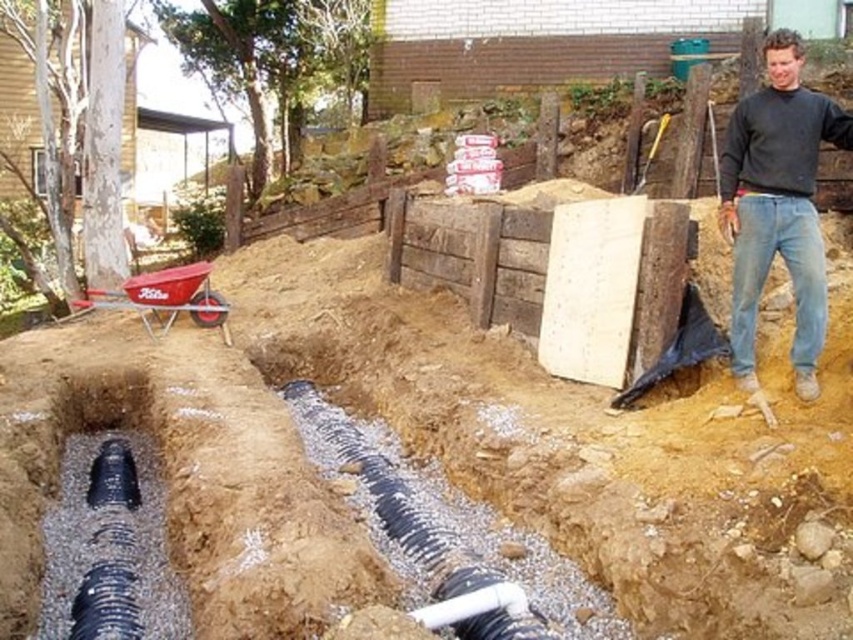
Question: Does dark gray sweater at upper right appear on the right side of black textured pipe at center?

Choices:
 (A) yes
 (B) no

Answer: (A)

Question: Which object is farther from the camera taking this photo?

Choices:
 (A) dark gray sweater at upper right
 (B) black textured pipe at center
 (C) black rubber pipe at lower left

Answer: (A)

Question: Which object is farther from the camera taking this photo?

Choices:
 (A) dark gray sweater at upper right
 (B) black textured pipe at center

Answer: (A)

Question: Is dark gray sweater at upper right closer to the viewer compared to black textured pipe at center?

Choices:
 (A) no
 (B) yes

Answer: (A)

Question: Is black rubber pipe at lower left to the left of black textured pipe at center from the viewer's perspective?

Choices:
 (A) no
 (B) yes

Answer: (B)

Question: Which point appears farthest from the camera in this image?

Choices:
 (A) (135, 496)
 (B) (444, 550)

Answer: (A)